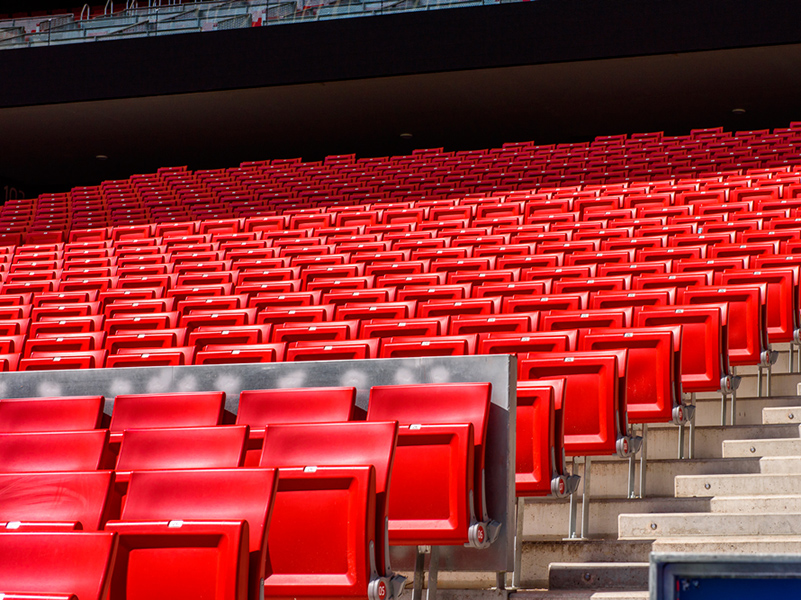
Where is `metal bolts in stairs`? metal bolts in stairs is located at coordinates (588, 572), (651, 526), (706, 484), (753, 446), (791, 414).